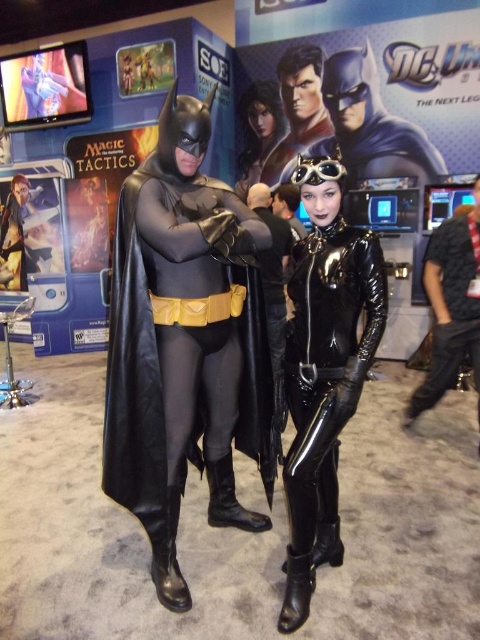
Question: Is black latex bodysuit at center closer to the viewer compared to matte black suit at right?

Choices:
 (A) no
 (B) yes

Answer: (B)

Question: Observing the image, what is the correct spatial positioning of matte black suit at right in reference to glossy black costume at center?

Choices:
 (A) right
 (B) left

Answer: (A)

Question: Can you confirm if matte black costume at center is bigger than matte black suit at right?

Choices:
 (A) no
 (B) yes

Answer: (B)

Question: Among these points, which one is nearest to the camera?

Choices:
 (A) (450, 234)
 (B) (160, 428)
 (C) (360, 364)

Answer: (C)

Question: Among these points, which one is farthest from the camera?

Choices:
 (A) (248, 188)
 (B) (126, 356)
 (C) (456, 352)
 (D) (357, 246)

Answer: (A)

Question: Which object is the farthest from the glossy black costume at center?

Choices:
 (A) black latex bodysuit at center
 (B) matte black costume at center

Answer: (A)